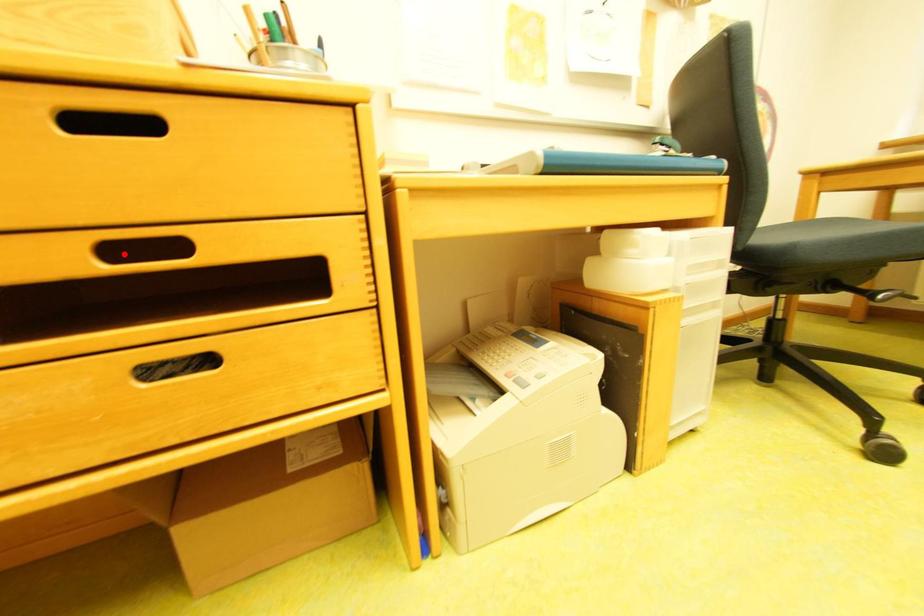
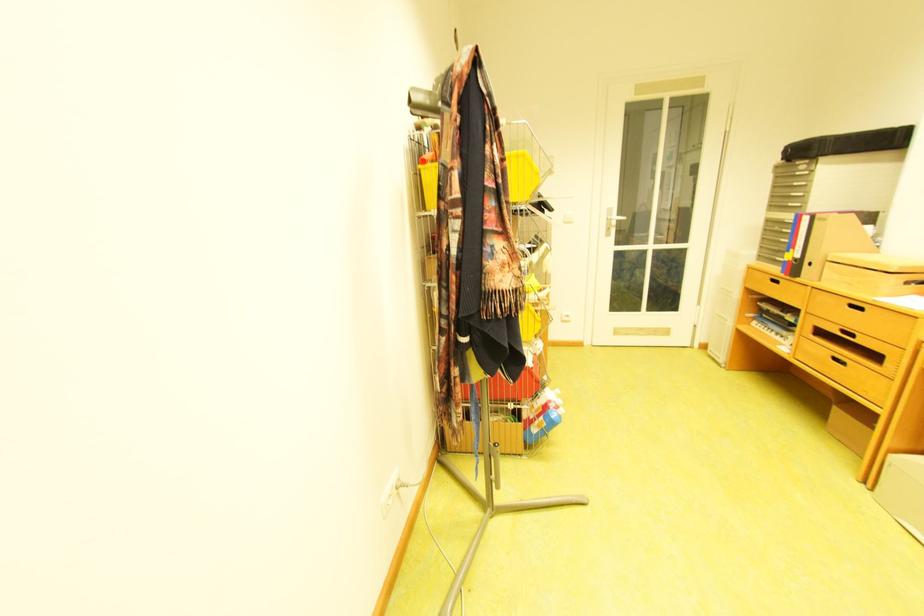
Question: I am providing you with two images of the same scene from different viewpoints. A red point is shown in image1. For the corresponding object point in image2, is it positioned nearer or farther from the camera?

Choices:
 (A) Nearer
 (B) Farther

Answer: (B)